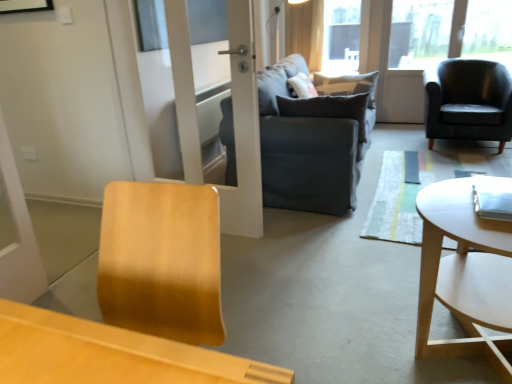
At what (x,y) coordinates should I click in order to perform the action: click on free space behind white wood coffee table at right. Please return your answer as a coordinate pair (x, y). This screenshot has height=384, width=512. Looking at the image, I should click on (x=373, y=281).